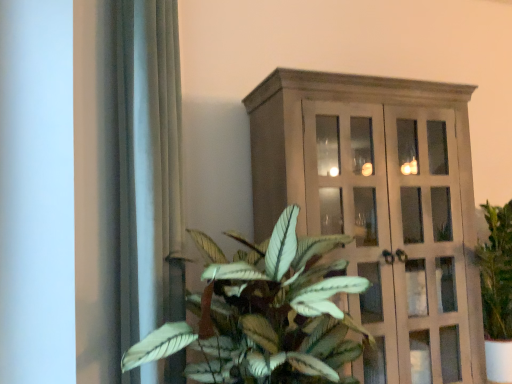
Question: Does wooden cabinet at upper center appear on the right side of satin gray curtain at left?

Choices:
 (A) no
 (B) yes

Answer: (B)

Question: From the image's perspective, does wooden cabinet at upper center appear lower than satin gray curtain at left?

Choices:
 (A) yes
 (B) no

Answer: (A)

Question: Is wooden cabinet at upper center oriented towards satin gray curtain at left?

Choices:
 (A) no
 (B) yes

Answer: (A)

Question: Is wooden cabinet at upper center placed right next to satin gray curtain at left?

Choices:
 (A) yes
 (B) no

Answer: (B)

Question: Would you consider wooden cabinet at upper center to be distant from satin gray curtain at left?

Choices:
 (A) yes
 (B) no

Answer: (B)

Question: From a real-world perspective, is satin gray curtain at left physically located above or below green leafy plant at center?

Choices:
 (A) above
 (B) below

Answer: (A)

Question: Considering the relative positions of satin gray curtain at left and green leafy plant at center in the image provided, is satin gray curtain at left to the left or to the right of green leafy plant at center?

Choices:
 (A) right
 (B) left

Answer: (B)

Question: Considering the positions of point (151, 119) and point (350, 327), is point (151, 119) closer or farther from the camera than point (350, 327)?

Choices:
 (A) closer
 (B) farther

Answer: (A)

Question: Relative to green leafy plant at center, is satin gray curtain at left in front or behind?

Choices:
 (A) behind
 (B) front

Answer: (A)

Question: Considering the positions of wooden cabinet at upper center and matte wooden cabinet at right in the image, is wooden cabinet at upper center wider or thinner than matte wooden cabinet at right?

Choices:
 (A) thin
 (B) wide

Answer: (A)

Question: Looking at the image, does wooden cabinet at upper center seem bigger or smaller compared to matte wooden cabinet at right?

Choices:
 (A) big
 (B) small

Answer: (A)

Question: In the image, is wooden cabinet at upper center positioned in front of or behind matte wooden cabinet at right?

Choices:
 (A) behind
 (B) front

Answer: (B)

Question: From the image's perspective, relative to matte wooden cabinet at right, is wooden cabinet at upper center above or below?

Choices:
 (A) above
 (B) below

Answer: (A)

Question: Would you say matte wooden cabinet at right is inside or outside satin gray curtain at left?

Choices:
 (A) inside
 (B) outside

Answer: (B)

Question: Considering the positions of matte wooden cabinet at right and satin gray curtain at left in the image, is matte wooden cabinet at right taller or shorter than satin gray curtain at left?

Choices:
 (A) short
 (B) tall

Answer: (A)